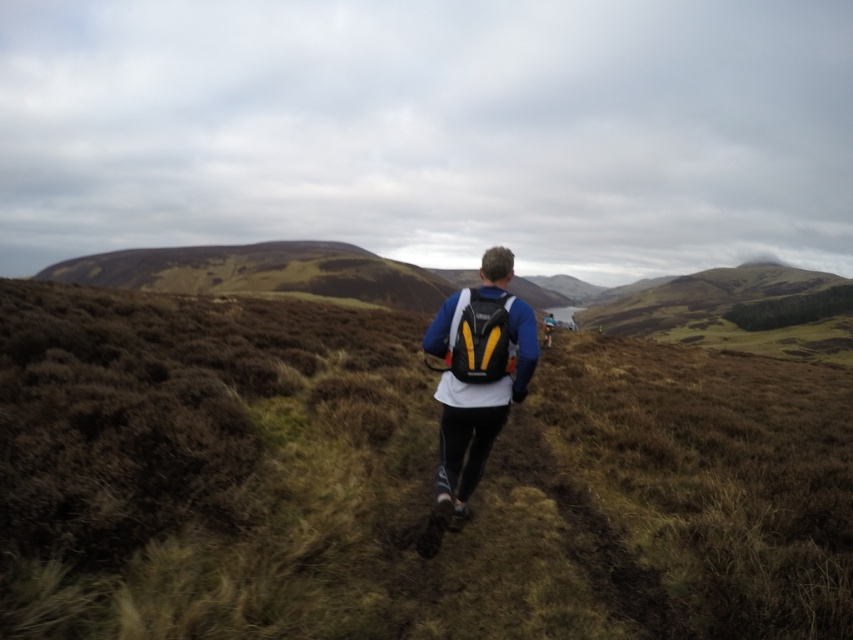
You are a hiker who wants to ensure your backpack is visible to others in case of an emergency. Based on the scene, will the white fabric backpack at center be easily visible against the brown grassy at center?

The brown grassy at center has a greater height compared to the white fabric backpack at center, so the backpack might be partially obscured by the taller grass, making it less visible.

You are a hiker trying to estimate distances in the rugged landscape. If you see the brown grassy at center and the white fabric backpack at center, how far apart are they?

The brown grassy at center and the white fabric backpack at center are 30.33 feet apart.

You are a photographer aiming to capture the hiker in the image. Since the hiker is at the center, you want to ensure the white fabric backpack at center is visible. Considering the size of the brown grassy at center, will the backpack be mostly hidden?

The brown grassy at center is bigger than the white fabric backpack at center, so the backpack might be mostly hidden by the grassy area.